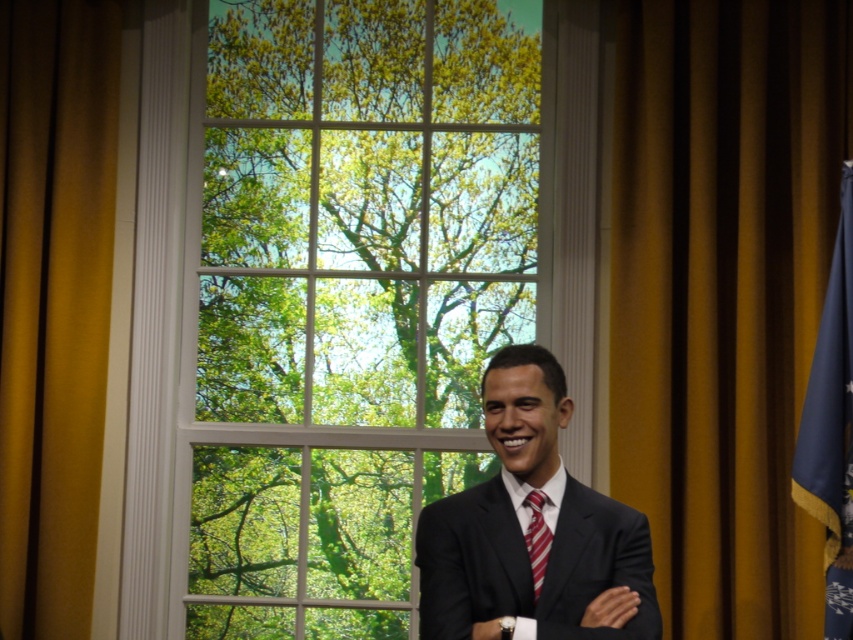
Is white glass window at center closer to the viewer compared to blue fabric flag at right?

No, white glass window at center is further to the viewer.

Between point (170, 36) and point (804, 417), which one is positioned behind?

Positioned behind is point (170, 36).

You are a GUI agent. You are given a task and a screenshot of the screen. Output one action in this format:
    pyautogui.click(x=<x>, y=<y>)
    Task: Click on the white glass window at center
    The width and height of the screenshot is (853, 640).
    Given the screenshot: What is the action you would take?
    pyautogui.click(x=335, y=289)

Who is lower down, gold fabric curtain at right or black matte suit at center?

Positioned lower is black matte suit at center.

Does point (685, 131) come in front of point (549, 438)?

No, (685, 131) is further to viewer.

Image resolution: width=853 pixels, height=640 pixels. Describe the element at coordinates (722, 292) in the screenshot. I see `gold fabric curtain at right` at that location.

At what (x,y) coordinates should I click in order to perform the action: click on gold fabric curtain at right. Please return your answer as a coordinate pair (x, y). This screenshot has width=853, height=640. Looking at the image, I should click on (722, 292).

Is gold fabric curtain at right smaller than gold fabric curtain at left?

No.

Which of these two, gold fabric curtain at right or gold fabric curtain at left, stands taller?

Standing taller between the two is gold fabric curtain at left.

Does point (755, 541) lie in front of point (79, 564)?

Yes, point (755, 541) is closer to viewer.

At what (x,y) coordinates should I click in order to perform the action: click on gold fabric curtain at right. Please return your answer as a coordinate pair (x, y). This screenshot has width=853, height=640. Looking at the image, I should click on (722, 292).